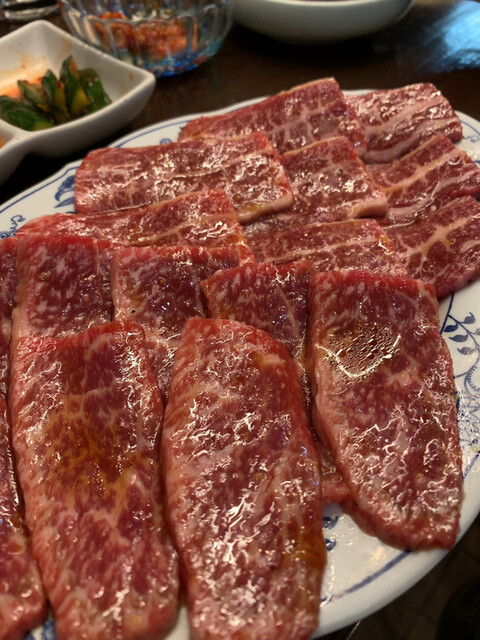
The image size is (480, 640). In order to click on glass bowl in this screenshot , I will do `click(173, 59)`.